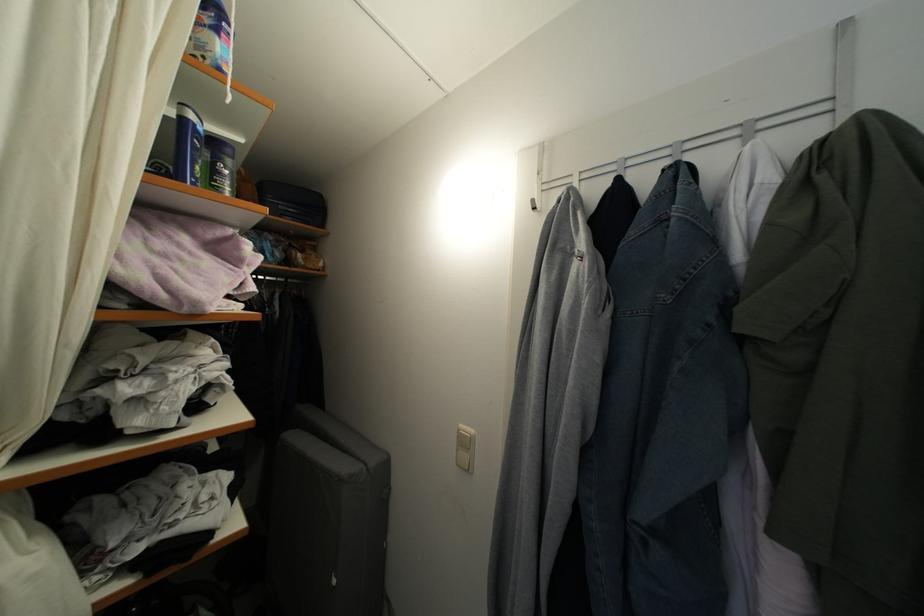
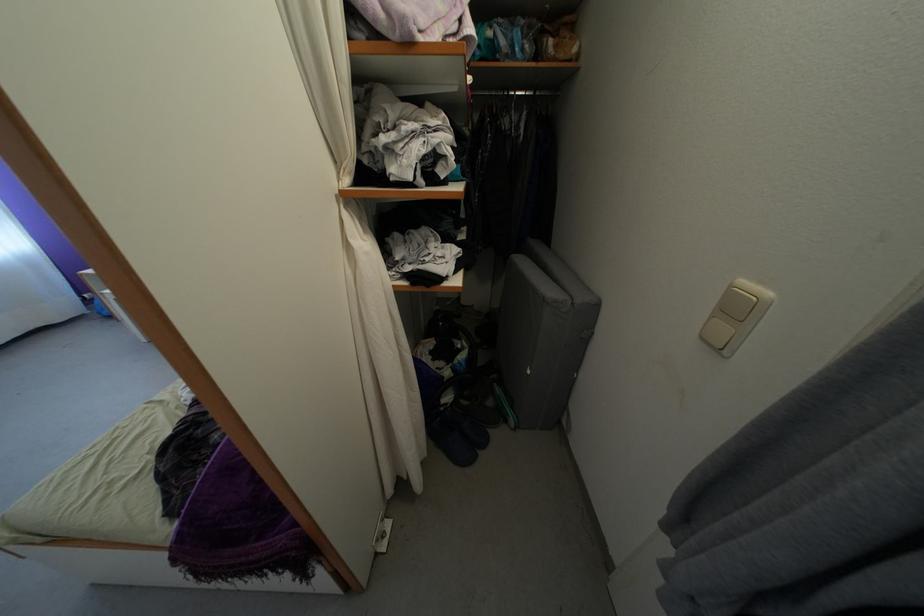
In the second image, find the point that corresponds to the point at 295,286 in the first image.

(543, 98)